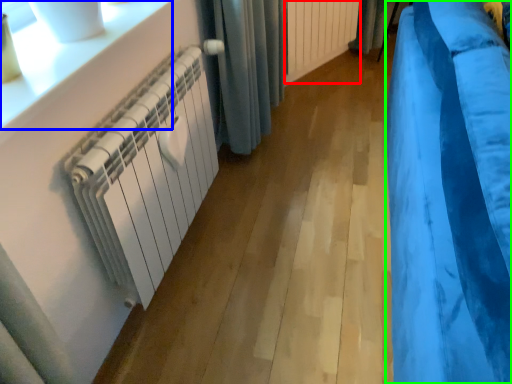
Question: Which object is the farthest from radiator (highlighted by a red box)? Choose among these: window sill (highlighted by a blue box) or curtain (highlighted by a green box).

Choices:
 (A) window sill
 (B) curtain

Answer: (A)